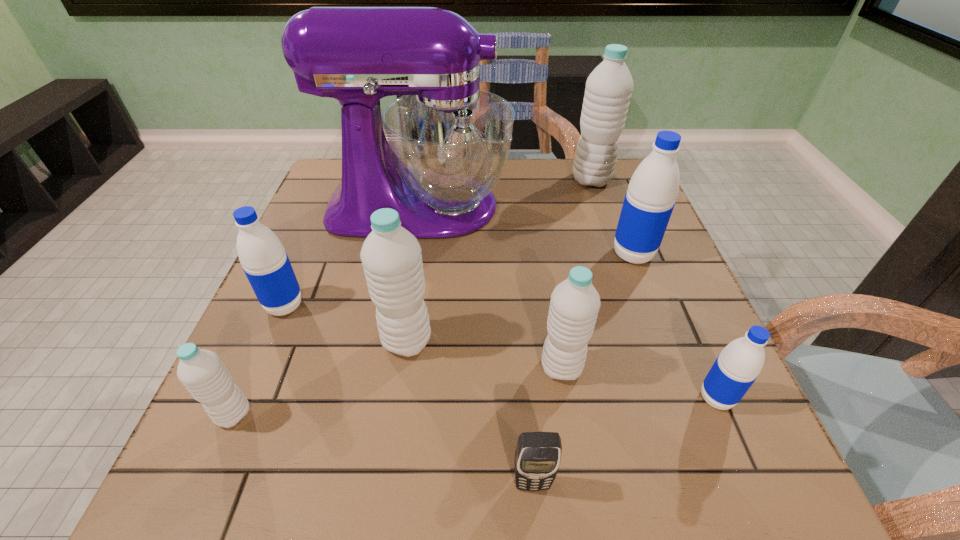
Locate which blue water bottle is the second closest to the leftmost white water bottle. Please provide its 2D coordinates. Your answer should be formatted as a tuple, i.e. [(x, y)], where the tuple contains the x and y coordinates of a point satisfying the conditions above.

[(737, 367)]

Locate an element on the screen. The width and height of the screenshot is (960, 540). free space that satisfies the following two spatial constraints: 1. at the bowl opening of the tallest object; 2. on the front side of the nearest white water bottle is located at coordinates 384,414.